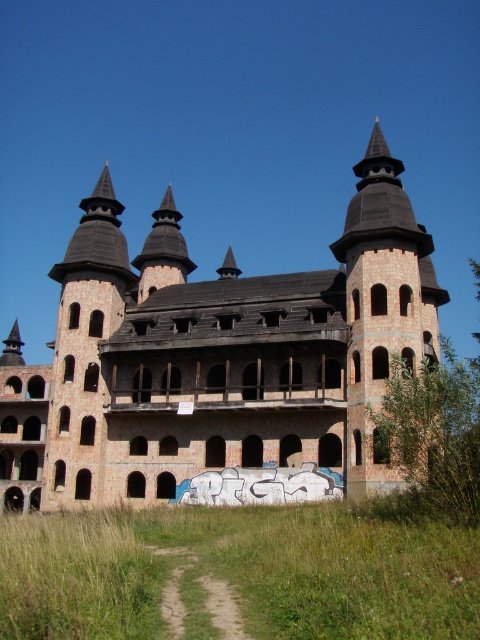
Question: Is brown brick castle at center wider than brown stone tower at upper right?

Choices:
 (A) yes
 (B) no

Answer: (A)

Question: Is brown brick castle at center wider than brown stone tower at upper right?

Choices:
 (A) no
 (B) yes

Answer: (B)

Question: Is brown brick castle at center closer to the viewer compared to brown stone tower at upper right?

Choices:
 (A) no
 (B) yes

Answer: (A)

Question: Which point is closer to the camera?

Choices:
 (A) (110, 305)
 (B) (379, 358)

Answer: (B)

Question: Which point appears farthest from the camera in this image?

Choices:
 (A) (340, 260)
 (B) (103, 444)

Answer: (A)